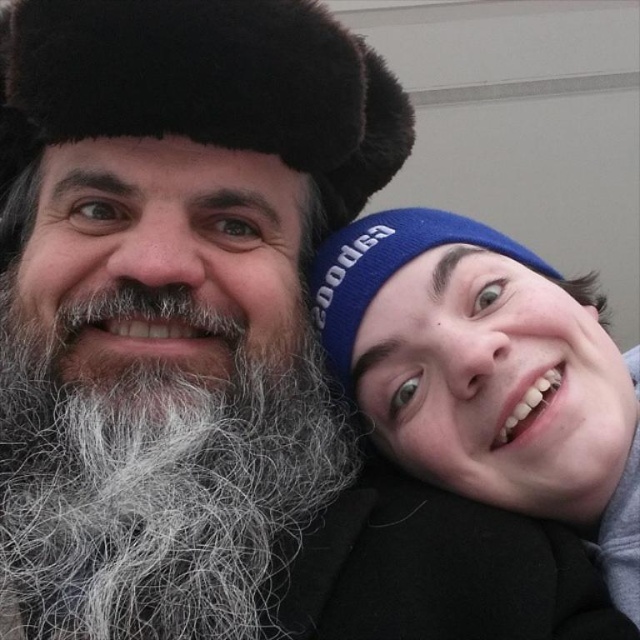
Question: Is gray fluffy beard at left closer to camera compared to blue knit cap at right?

Choices:
 (A) no
 (B) yes

Answer: (B)

Question: Which is farther from the blue knit cap at right?

Choices:
 (A) blue knit cap at upper right
 (B) gray fluffy beard at left
 (C) fuzzy fur hat at upper left

Answer: (B)

Question: Which point is closer to the camera?

Choices:
 (A) gray fluffy beard at left
 (B) fuzzy fur hat at upper left
 (C) blue knit cap at right
 (D) blue knit cap at upper right

Answer: (A)

Question: Does blue knit cap at upper right have a smaller size compared to blue knit cap at right?

Choices:
 (A) no
 (B) yes

Answer: (A)

Question: Which object appears closest to the camera in this image?

Choices:
 (A) fuzzy fur hat at upper left
 (B) blue knit cap at upper right

Answer: (B)

Question: Is gray fluffy beard at left closer to the viewer compared to fuzzy fur hat at upper left?

Choices:
 (A) yes
 (B) no

Answer: (A)